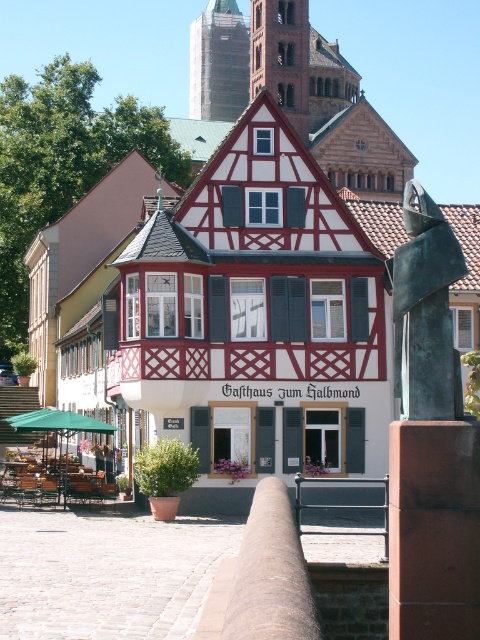
Question: Can you confirm if brown stone tower at upper center is positioned to the left of red brick tower at upper center?

Choices:
 (A) yes
 (B) no

Answer: (A)

Question: Which point is closer to the camera?

Choices:
 (A) red brick tower at upper center
 (B) metallic gray rail at center
 (C) brown stone tower at upper center

Answer: (B)

Question: Which object is positioned closest to the metallic gray rail at center?

Choices:
 (A) brown stone tower at upper center
 (B) red brick tower at upper center

Answer: (B)

Question: Does bronze sculpture at right have a lesser width compared to red brick tower at upper center?

Choices:
 (A) no
 (B) yes

Answer: (B)

Question: Which object appears closest to the camera in this image?

Choices:
 (A) red brick tower at upper center
 (B) brown stone tower at upper center

Answer: (A)

Question: Can you confirm if brown stone tower at upper center is wider than metallic gray rail at center?

Choices:
 (A) yes
 (B) no

Answer: (A)